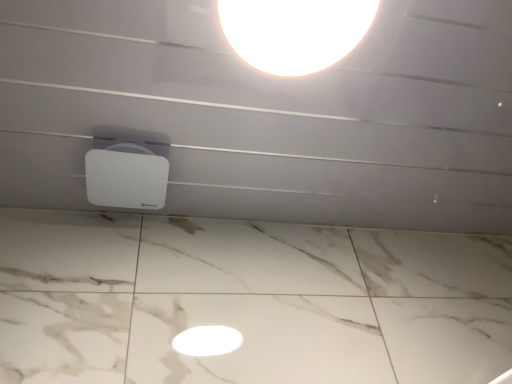
Question: Which direction should I rotate to look at white glossy lampshade at upper center, the second lamp from the bottom?

Choices:
 (A) right
 (B) left

Answer: (A)

Question: Is white glossy lampshade at upper center, placed as the 2th lamp when sorted from left to right, outside white matte speaker at center, marked as the 1th lamp in a back-to-front arrangement?

Choices:
 (A) yes
 (B) no

Answer: (A)

Question: Does white glossy lampshade at upper center, positioned as the first lamp in right-to-left order, have a greater width compared to white matte speaker at center, which is the second lamp in top-to-bottom order?

Choices:
 (A) yes
 (B) no

Answer: (A)

Question: Does white glossy lampshade at upper center, the 2th lamp viewed from the back, have a larger size compared to white matte speaker at center, the 1th lamp ordered from the bottom?

Choices:
 (A) no
 (B) yes

Answer: (B)

Question: Is white glossy lampshade at upper center, placed as the 2th lamp when sorted from left to right, closer to camera compared to white matte speaker at center, the second lamp from the right?

Choices:
 (A) yes
 (B) no

Answer: (A)

Question: Is white glossy lampshade at upper center, positioned as the first lamp in right-to-left order, aimed at white matte speaker at center, the 1th lamp ordered from the bottom?

Choices:
 (A) yes
 (B) no

Answer: (B)

Question: Considering the relative positions of white glossy lampshade at upper center, placed as the 2th lamp when sorted from left to right, and white matte speaker at center, marked as the 1th lamp in a back-to-front arrangement, in the image provided, is white glossy lampshade at upper center, placed as the 2th lamp when sorted from left to right, to the right of white matte speaker at center, marked as the 1th lamp in a back-to-front arrangement, from the viewer's perspective?

Choices:
 (A) yes
 (B) no

Answer: (A)

Question: Considering the relative sizes of white matte speaker at center, marked as the 1th lamp in a back-to-front arrangement, and white glossy lampshade at upper center, the second lamp from the bottom, in the image provided, is white matte speaker at center, marked as the 1th lamp in a back-to-front arrangement, smaller than white glossy lampshade at upper center, the second lamp from the bottom,?

Choices:
 (A) no
 (B) yes

Answer: (B)

Question: Can you confirm if white matte speaker at center, arranged as the 2th lamp when viewed from the front, is taller than white glossy lampshade at upper center, the 1th lamp in the top-to-bottom sequence?

Choices:
 (A) no
 (B) yes

Answer: (A)

Question: From the image's perspective, is white matte speaker at center, the 1th lamp ordered from the bottom, located above white glossy lampshade at upper center, the second lamp from the bottom?

Choices:
 (A) no
 (B) yes

Answer: (A)

Question: Considering the relative sizes of white matte speaker at center, the second lamp from the right, and white glossy lampshade at upper center, positioned as the first lamp in front-to-back order, in the image provided, is white matte speaker at center, the second lamp from the right, wider than white glossy lampshade at upper center, positioned as the first lamp in front-to-back order,?

Choices:
 (A) yes
 (B) no

Answer: (B)

Question: Is white matte speaker at center, the 1th lamp ordered from the bottom, facing towards white glossy lampshade at upper center, positioned as the first lamp in right-to-left order?

Choices:
 (A) no
 (B) yes

Answer: (B)

Question: Considering the relative positions of white matte speaker at center, marked as the 1th lamp in a back-to-front arrangement, and white glossy lampshade at upper center, placed as the 2th lamp when sorted from left to right, in the image provided, is white matte speaker at center, marked as the 1th lamp in a back-to-front arrangement, to the right of white glossy lampshade at upper center, placed as the 2th lamp when sorted from left to right, from the viewer's perspective?

Choices:
 (A) no
 (B) yes

Answer: (A)

Question: Is point (289, 39) closer or farther from the camera than point (92, 165)?

Choices:
 (A) closer
 (B) farther

Answer: (A)